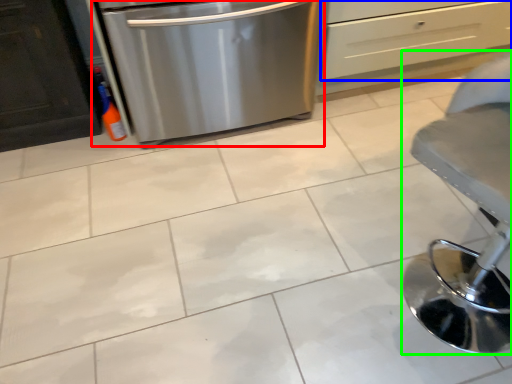
Question: Which object is positioned closest to home appliance (highlighted by a red box)? Select from drawer (highlighted by a blue box) and furniture (highlighted by a green box).

Choices:
 (A) drawer
 (B) furniture

Answer: (A)